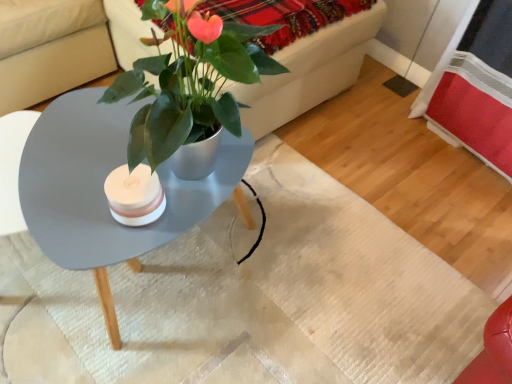
You are a GUI agent. You are given a task and a screenshot of the screen. Output one action in this format:
    pyautogui.click(x=<x>, y=<y>)
    Task: Click on the free spot to the right of matte gray coffee table at center
    
    Given the screenshot: What is the action you would take?
    pyautogui.click(x=323, y=252)